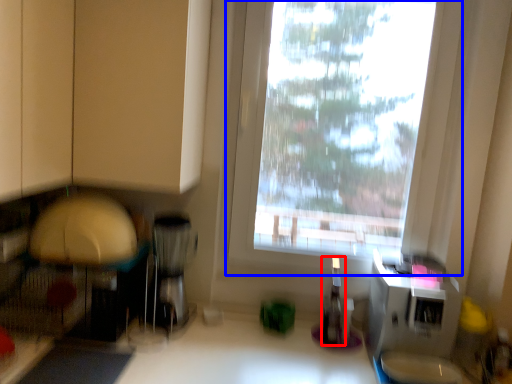
Question: Which of the following is the closest to the observer, bottle (highlighted by a red box) or window (highlighted by a blue box)?

Choices:
 (A) bottle
 (B) window

Answer: (B)